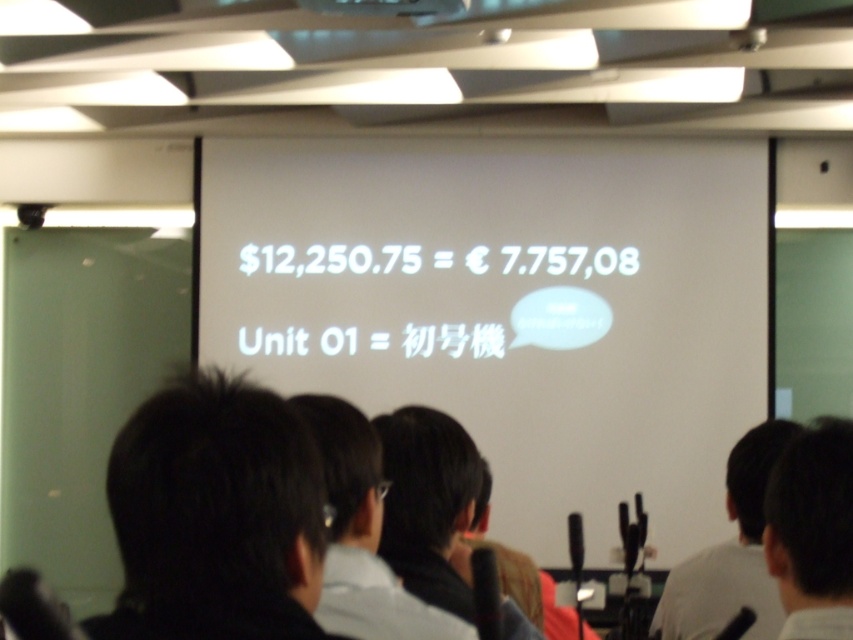
Does black hair at left lie in front of dark hair at upper right?

Yes, black hair at left is in front of dark hair at upper right.

Image resolution: width=853 pixels, height=640 pixels. I want to click on black hair at left, so click(215, 516).

Identify the location of black hair at left. (215, 516).

Does dark hair at upper right have a greater height compared to matte white projector at upper center?

Correct, dark hair at upper right is much taller as matte white projector at upper center.

Is dark hair at upper right thinner than matte white projector at upper center?

Yes, dark hair at upper right is thinner than matte white projector at upper center.

Locate an element on the screen. This screenshot has width=853, height=640. dark hair at upper right is located at coordinates (811, 531).

Which of these two, white shirt at right or matte white projector at upper center, stands shorter?

matte white projector at upper center is shorter.

Does white shirt at right have a smaller size compared to matte white projector at upper center?

No.

The width and height of the screenshot is (853, 640). What do you see at coordinates (730, 552) in the screenshot?
I see `white shirt at right` at bounding box center [730, 552].

Identify the location of white shirt at right. The image size is (853, 640). (730, 552).